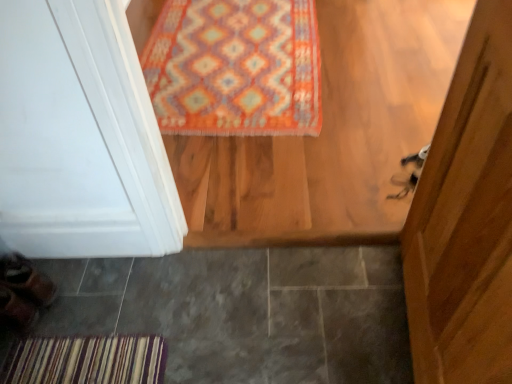
Image resolution: width=512 pixels, height=384 pixels. Find the location of `vacant area that lies to the right of leather brown shoe at lower left, the 1th shoe ordered from the bottom`. vacant area that lies to the right of leather brown shoe at lower left, the 1th shoe ordered from the bottom is located at coordinates (59, 319).